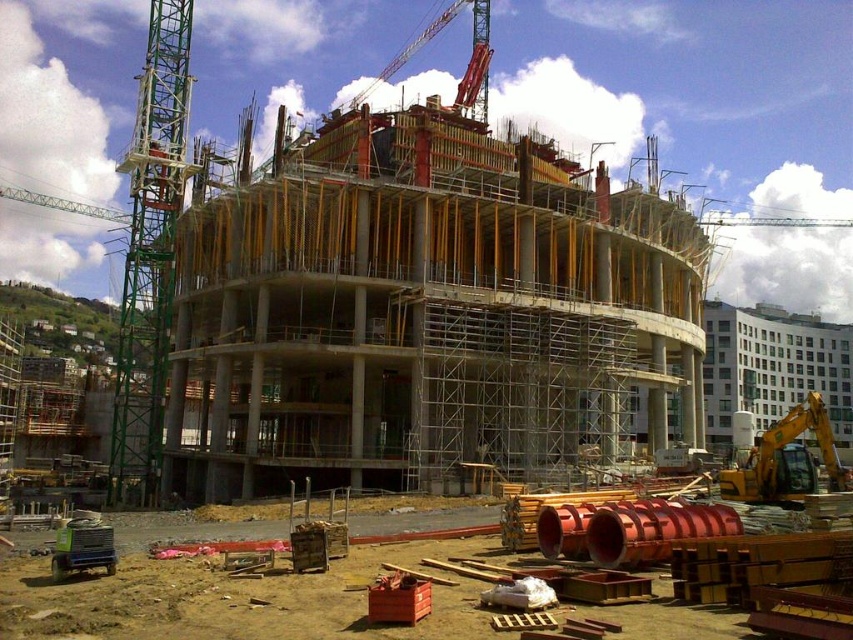
Question: Among these points, which one is nearest to the camera?

Choices:
 (A) (90, 536)
 (B) (444, 19)
 (C) (831, 442)

Answer: (A)

Question: Among these objects, which one is nearest to the camera?

Choices:
 (A) green plastic generator at lower left
 (B) orange metallic pipes at lower center
 (C) metallic red crane at upper center

Answer: (B)

Question: Which point appears closest to the camera in this image?

Choices:
 (A) (387, 68)
 (B) (419, 554)
 (C) (136, 150)
 (D) (61, 557)

Answer: (D)

Question: Is silver metallic scaffolding at center thinner than yellow metallic excavator at lower right?

Choices:
 (A) no
 (B) yes

Answer: (B)

Question: Is the position of green metallic crane at left more distant than that of yellow metallic excavator at lower right?

Choices:
 (A) no
 (B) yes

Answer: (B)

Question: Can you confirm if green metallic crane at left is positioned to the right of yellow metallic excavator at lower right?

Choices:
 (A) yes
 (B) no

Answer: (B)